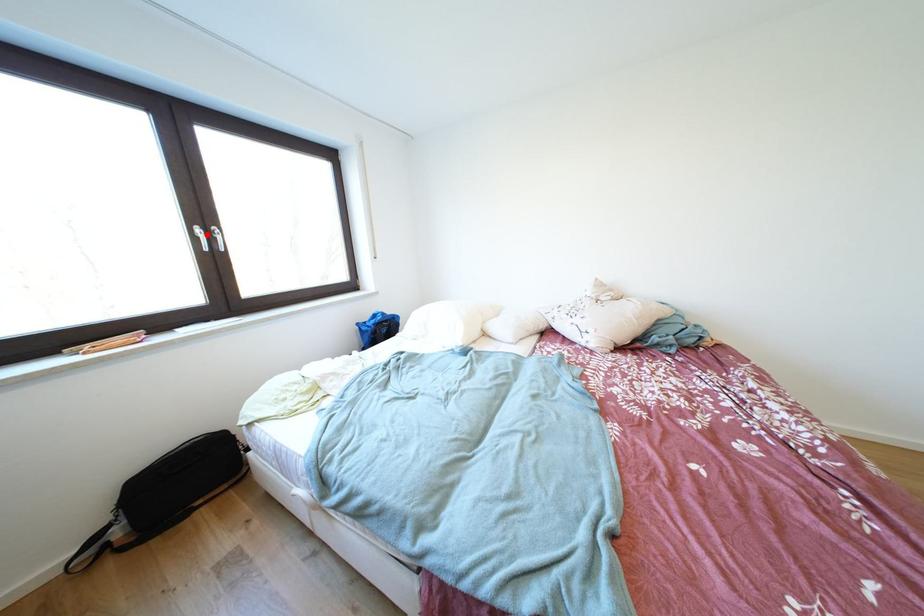
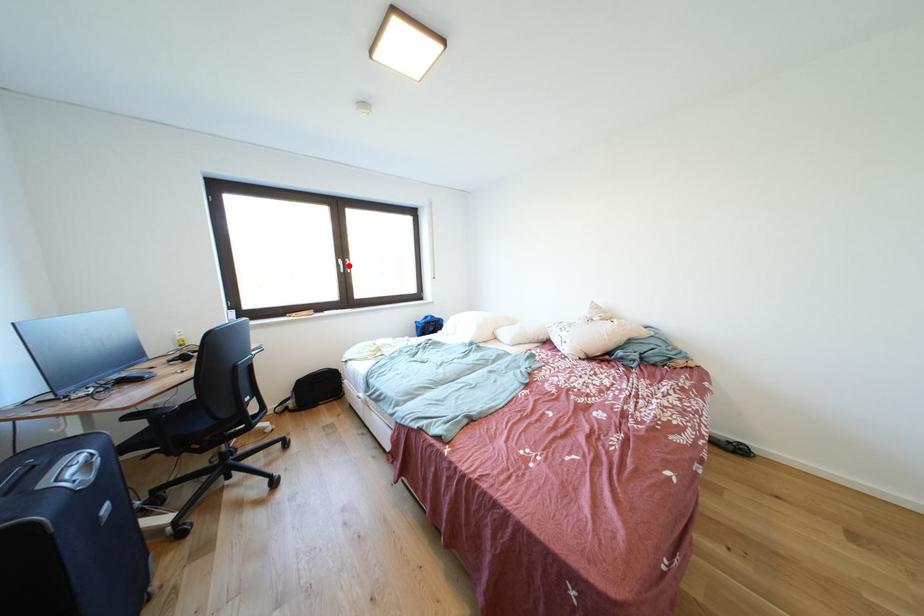
Based on the photo, I am providing you with two images of the same scene from different viewpoints. A red point is marked on the first image and another point is marked on the second image. Is the marked point in image1 the same physical position as the marked point in image2?

Yes